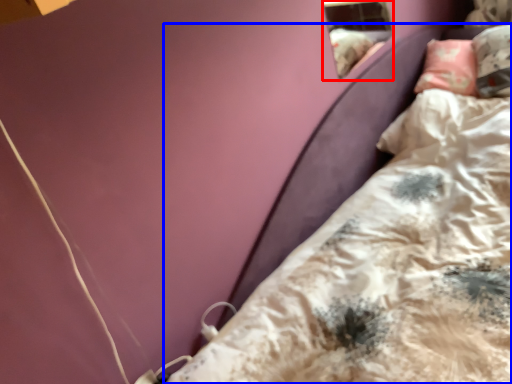
Question: Which object appears closest to the camera in this image, window (highlighted by a red box) or bed (highlighted by a blue box)?

Choices:
 (A) window
 (B) bed

Answer: (B)